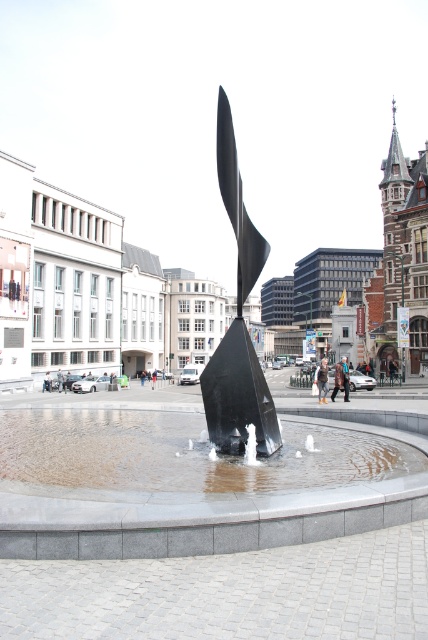
Does black polished water at center have a greater height compared to polished black sculpture at center?

Yes.

Who is positioned more to the left, black polished water at center or polished black sculpture at center?

black polished water at center

Between point (285, 468) and point (240, 346), which one is positioned behind?

The point (240, 346) is more distant.

At what (x,y) coordinates should I click in order to perform the action: click on black polished water at center. Please return your answer as a coordinate pair (x, y). Looking at the image, I should click on (190, 477).

Locate an element on the screen. clear water at fountain center is located at coordinates coord(184,452).

Does point (365, 442) come farther from viewer compared to point (222, 410)?

Yes, point (365, 442) is farther from viewer.

Locate an element on the screen. The image size is (428, 640). clear water at fountain center is located at coordinates (184, 452).

Find the location of a particular element. The image size is (428, 640). clear water at fountain center is located at coordinates (184, 452).

Who is more forward, [222,524] or [380,456]?

Point [222,524] is in front.

Is black polished water at center thinner than clear water at fountain center?

Incorrect, black polished water at center's width is not less than clear water at fountain center's.

Measure the distance between black polished water at center and camera.

black polished water at center is 21.02 meters away from camera.

This screenshot has height=640, width=428. In order to click on black polished water at center in this screenshot , I will do coord(190,477).